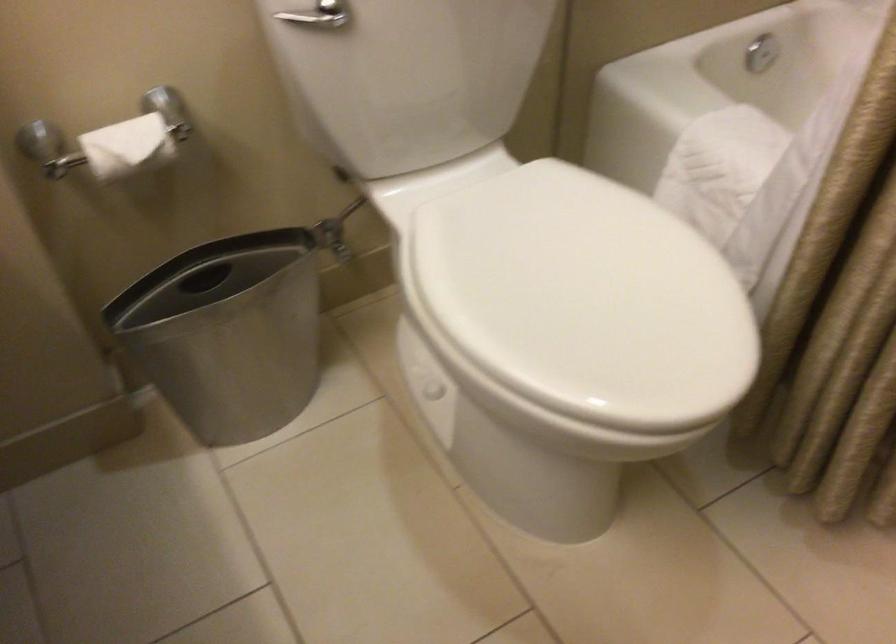
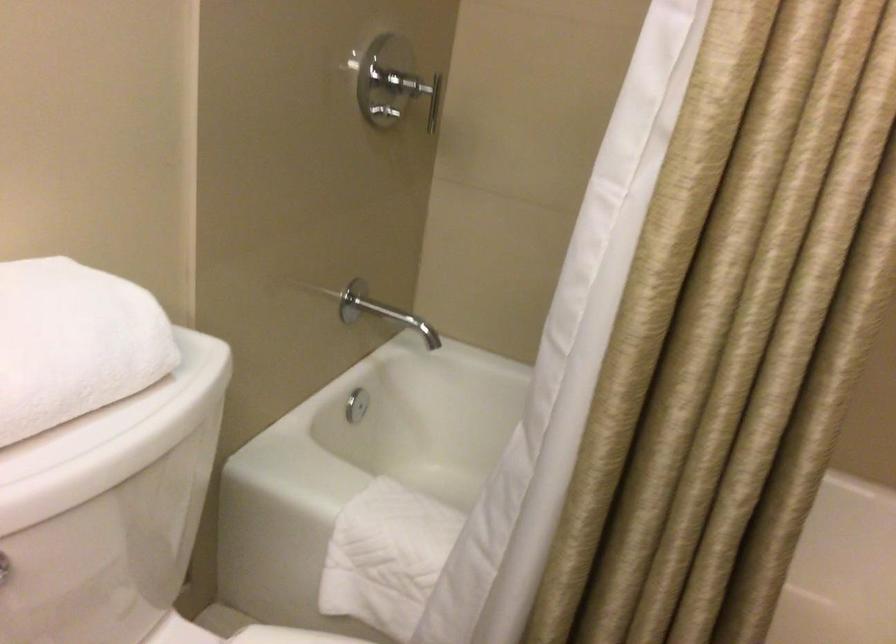
Question: Based on the continuous images, in which direction is the camera rotating? Reply with the corresponding letter.

Choices:
 (A) Left
 (B) Right
 (C) Up
 (D) Down

Answer: (B)